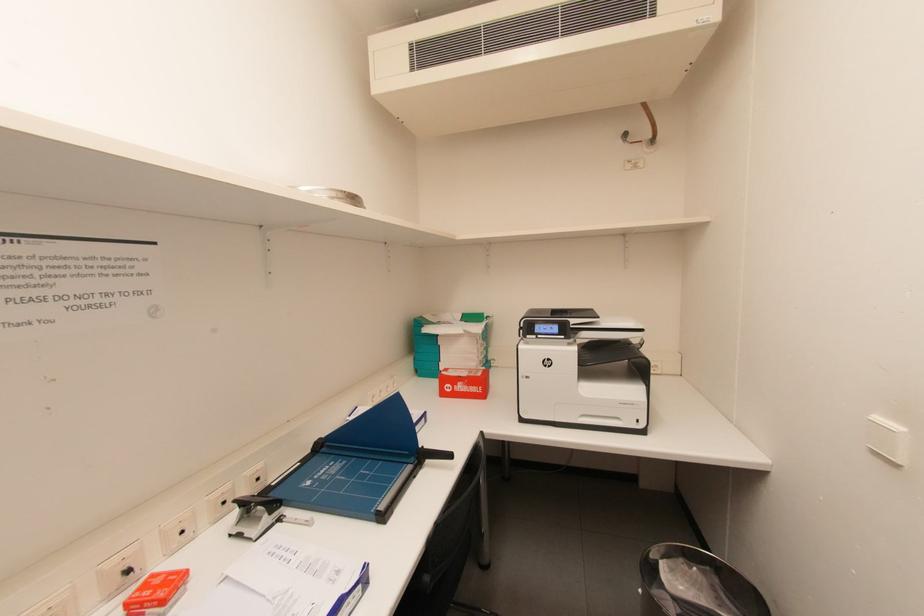
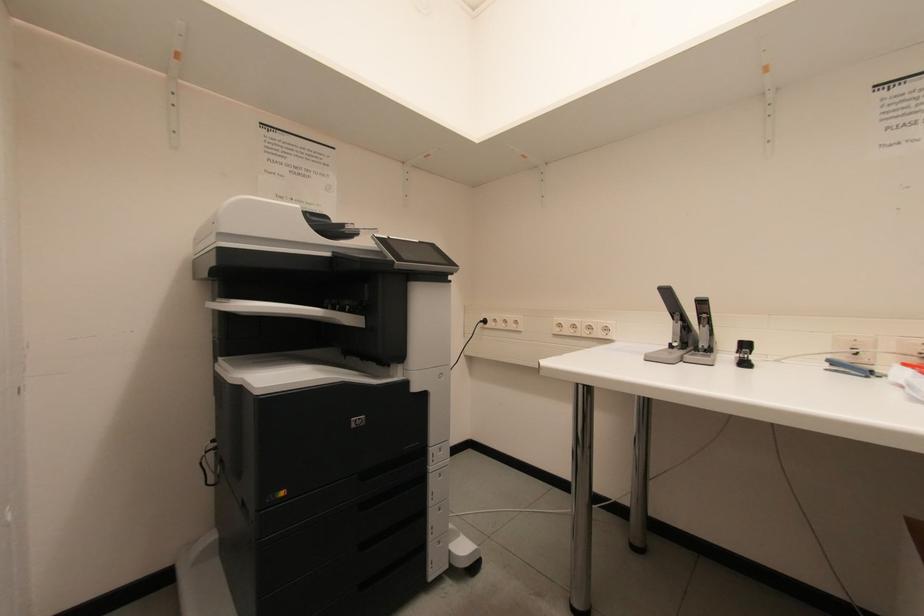
Question: The camera is either moving clockwise (left) or counter-clockwise (right) around the object. The first image is from the beginning of the video and the second image is from the end. Is the camera moving left or right when shooting the video?

Choices:
 (A) Left
 (B) Right

Answer: (B)